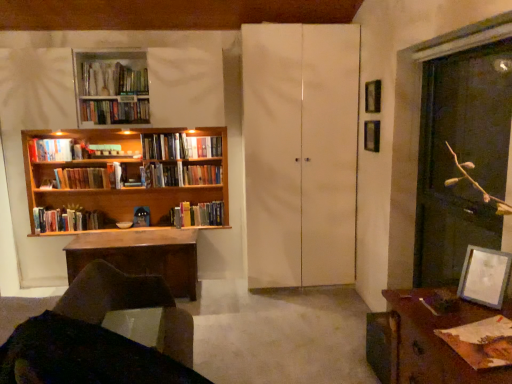
You are a GUI agent. You are given a task and a screenshot of the screen. Output one action in this format:
    pyautogui.click(x=<x>, y=<y>)
    Task: Click on the blank space situated above hardcover books at left, which is counted as the 5th book, starting from the front (from a real-world perspective)
    The width and height of the screenshot is (512, 384).
    Given the screenshot: What is the action you would take?
    pyautogui.click(x=79, y=168)